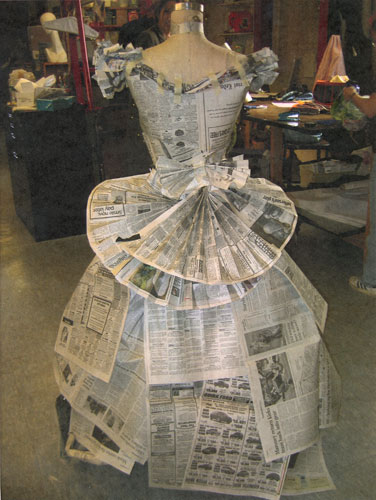
This screenshot has width=376, height=500. Identify the location of hanger. (57, 27).